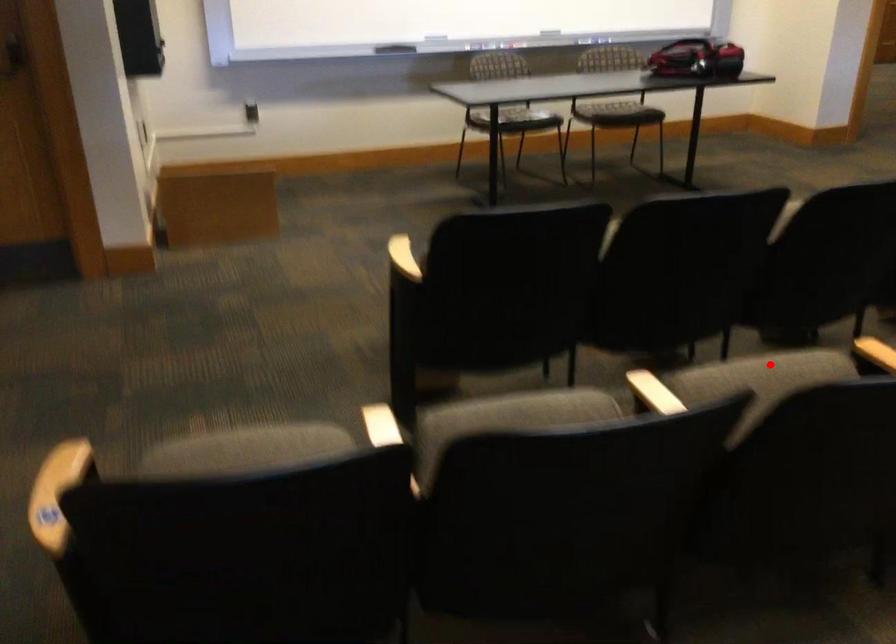
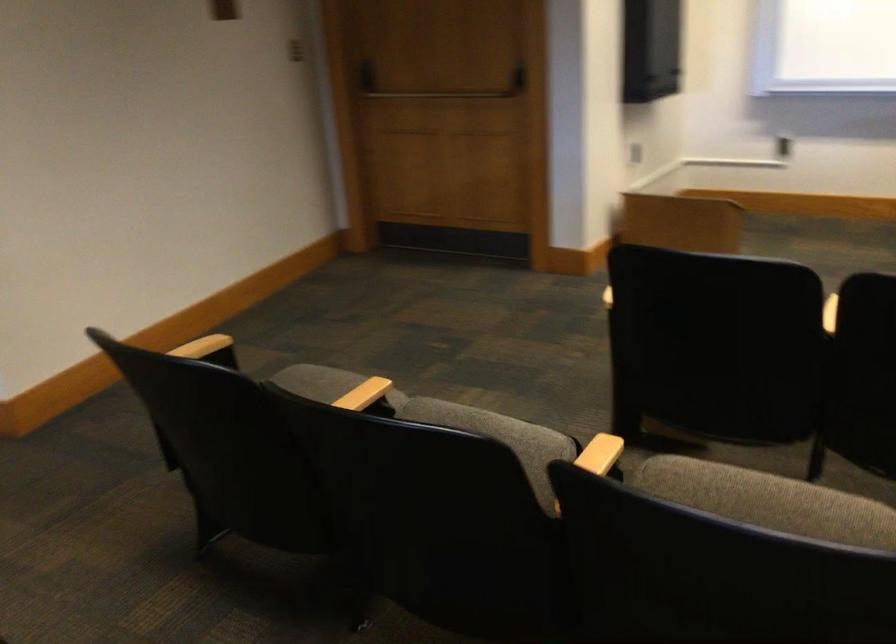
Find the pixel in the second image that matches the highlighted location in the first image.

(789, 504)